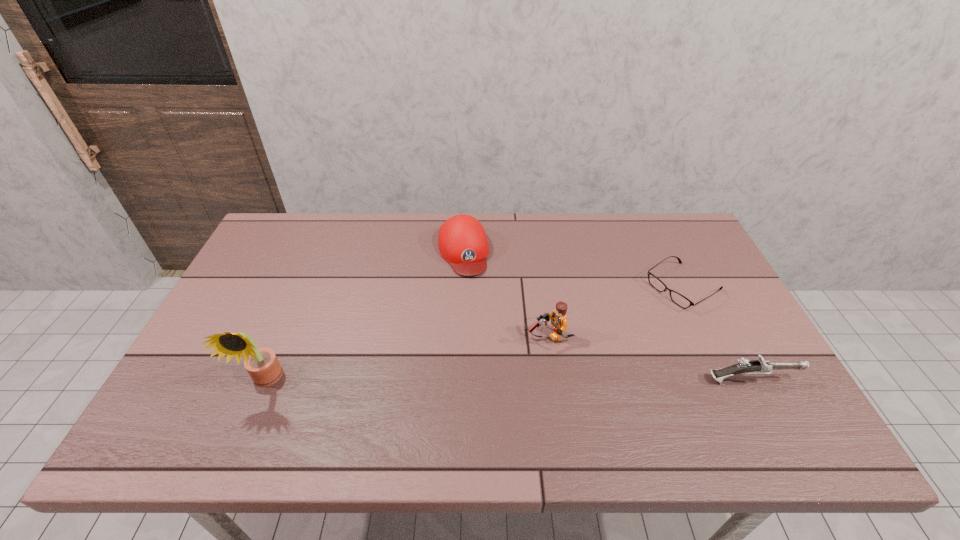
At what (x,y) coordinates should I click in order to perform the action: click on sunflower. Please return your answer as a coordinate pair (x, y). Looking at the image, I should click on (262, 364).

This screenshot has width=960, height=540. Identify the location of the leftmost object. (262, 364).

Identify the location of the second shortest object. (760, 366).

You are a GUI agent. You are given a task and a screenshot of the screen. Output one action in this format:
    pyautogui.click(x=<x>, y=<y>)
    Task: Click on the shortest object
    Image resolution: width=960 pixels, height=540 pixels.
    Given the screenshot: What is the action you would take?
    pyautogui.click(x=677, y=298)

The width and height of the screenshot is (960, 540). Identify the location of the third nearest object. (558, 317).

Locate an element on the screen. This screenshot has height=540, width=960. the third object from left to right is located at coordinates (558, 317).

Locate an element on the screen. This screenshot has height=540, width=960. the fourth object from right to left is located at coordinates pos(462,241).

The height and width of the screenshot is (540, 960). What are the coordinates of `free point located on the front-facing side of the spectacles` in the screenshot? It's located at (627, 321).

Where is `vacant point located on the front-facing side of the spectacles`? The width and height of the screenshot is (960, 540). vacant point located on the front-facing side of the spectacles is located at coordinates (625, 323).

The width and height of the screenshot is (960, 540). Find the location of `free region located 0.140m on the front-facing side of the spectacles`. free region located 0.140m on the front-facing side of the spectacles is located at coordinates (625, 323).